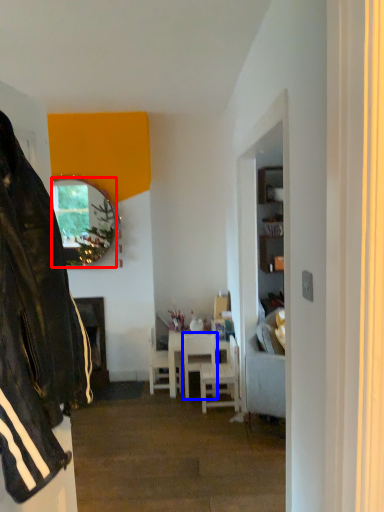
Question: Which of the following is the closest to the observer, mirror (highlighted by a red box) or chair (highlighted by a blue box)?

Choices:
 (A) mirror
 (B) chair

Answer: (B)